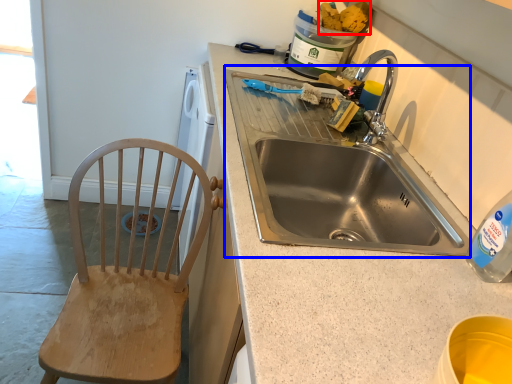
Question: Which object appears closest to the camera in this image, food (highlighted by a red box) or sink (highlighted by a blue box)?

Choices:
 (A) food
 (B) sink

Answer: (B)